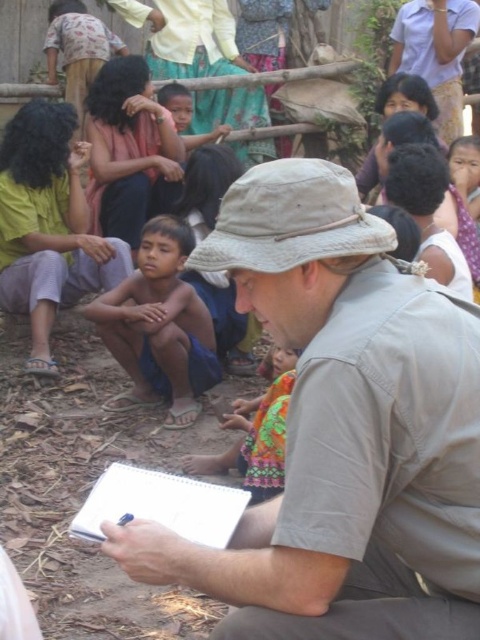
Question: Which of the following is the farthest from the observer?

Choices:
 (A) (130, 356)
 (B) (159, 166)

Answer: (B)

Question: Does blue shorts at center appear over white paper clipboard at center?

Choices:
 (A) yes
 (B) no

Answer: (A)

Question: Can you confirm if blue shorts at center is thinner than multicolored fabric dress at center?

Choices:
 (A) no
 (B) yes

Answer: (A)

Question: Is blue shorts at center bigger than white paper clipboard at center?

Choices:
 (A) no
 (B) yes

Answer: (B)

Question: Which point is closer to the camera?

Choices:
 (A) (275, 369)
 (B) (457, 541)

Answer: (B)

Question: Which of the following is the closest to the observer?

Choices:
 (A) brown skin child at center
 (B) white paper clipboard at center
 (C) blue shorts at center

Answer: (B)